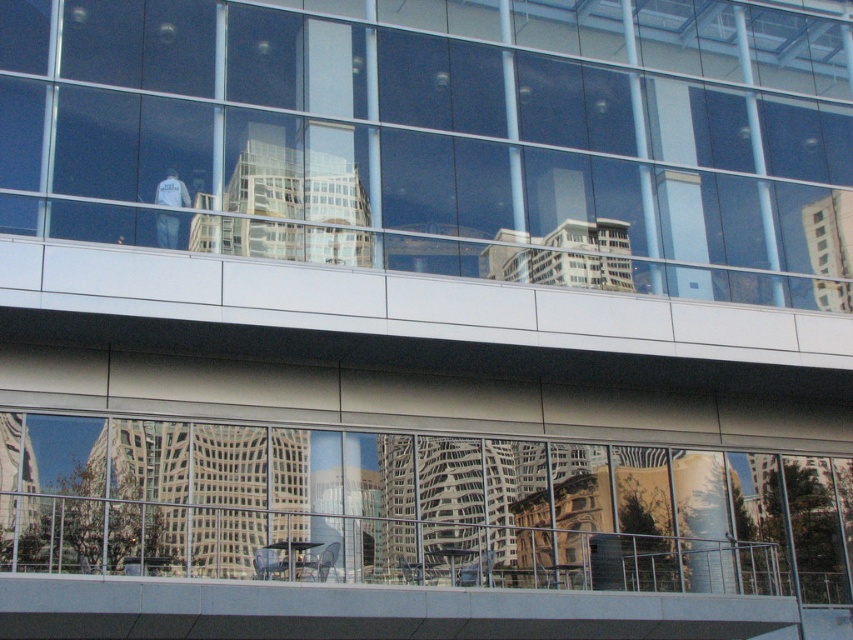
Question: Which of the following is the closest to the observer?

Choices:
 (A) [403, 264]
 (B) [514, 531]

Answer: (A)

Question: Can you confirm if transparent glass window at center is positioned to the right of transparent glass windows at lower center?

Choices:
 (A) no
 (B) yes

Answer: (A)

Question: Is transparent glass window at center wider than transparent glass windows at lower center?

Choices:
 (A) yes
 (B) no

Answer: (B)

Question: In this image, where is transparent glass window at center located relative to transparent glass windows at lower center?

Choices:
 (A) above
 (B) below

Answer: (A)

Question: Which object appears farthest from the camera in this image?

Choices:
 (A) transparent glass window at center
 (B) transparent glass windows at lower center

Answer: (A)